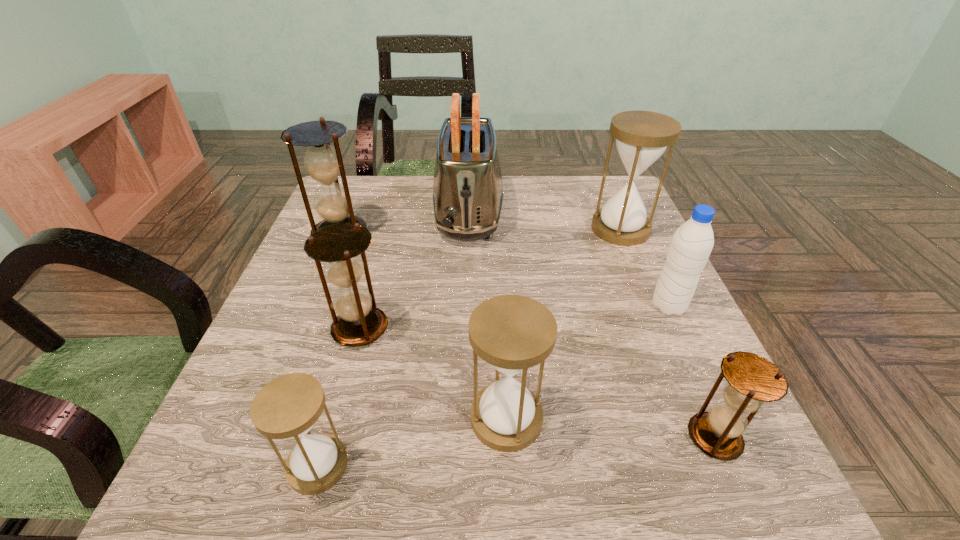
I want to click on gray toaster, so click(x=467, y=195).

Identify the location of the farthest white hourglass. The height and width of the screenshot is (540, 960). (642, 137).

This screenshot has width=960, height=540. In order to click on the rightmost white hourglass in this screenshot , I will do `click(642, 137)`.

This screenshot has height=540, width=960. I want to click on the farthest brown hourglass, so click(x=323, y=163).

Identify the location of water bottle. (691, 245).

Where is `the fourth nearest hourglass`? the fourth nearest hourglass is located at coordinates (359, 322).

At what (x,y) coordinates should I click in order to perform the action: click on the second biggest brown hourglass. Please return your answer as a coordinate pair (x, y). Image resolution: width=960 pixels, height=540 pixels. Looking at the image, I should click on (359, 322).

Locate an element on the screen. the second biggest white hourglass is located at coordinates (513, 333).

Image resolution: width=960 pixels, height=540 pixels. Identify the location of the second white hourglass from left to right. (513, 333).

This screenshot has width=960, height=540. Identify the location of the rightmost brown hourglass. 752,380.